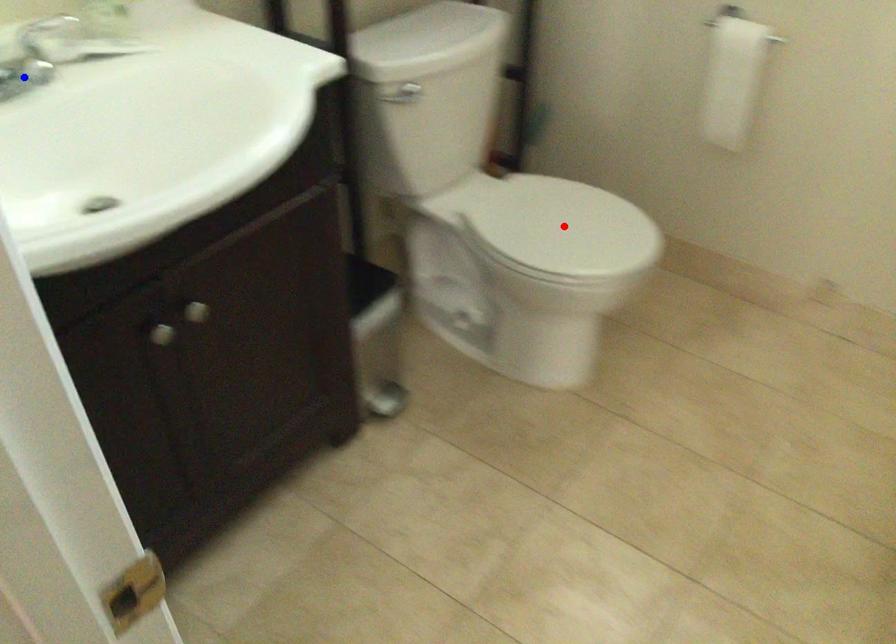
Question: In the image, two points are highlighted. Which point is nearer to the camera? Reply with the corresponding letter.

Choices:
 (A) blue point
 (B) red point

Answer: (A)